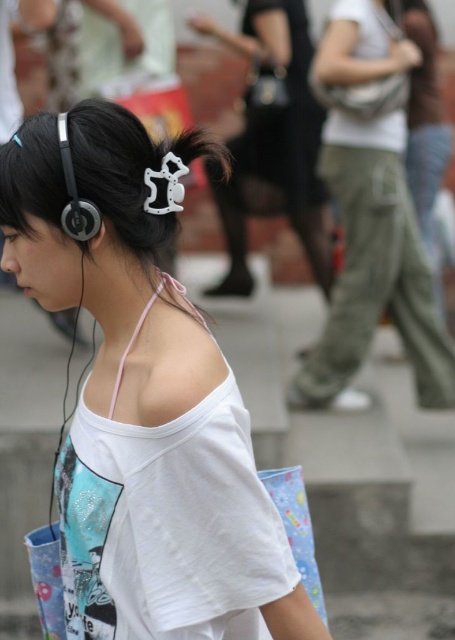
Question: Which point is farther to the camera?

Choices:
 (A) matte black hair clip at upper center
 (B) matte black earphone at upper left
 (C) green cotton pants at center

Answer: (A)

Question: Is white matte t-shirt at center below matte black earphone at upper left?

Choices:
 (A) no
 (B) yes

Answer: (B)

Question: Which is nearer to the matte black hair clip at upper center?

Choices:
 (A) black plastic hair clip at upper center
 (B) green cotton pants at center

Answer: (A)

Question: Which of these objects is positioned closest to the green cotton pants at center?

Choices:
 (A) black plastic hair clip at upper center
 (B) matte black earphone at upper left

Answer: (A)

Question: Does white matte t-shirt at center lie in front of matte black earphone at upper left?

Choices:
 (A) no
 (B) yes

Answer: (B)

Question: Is green cotton pants at center wider than matte black earphone at upper left?

Choices:
 (A) no
 (B) yes

Answer: (B)